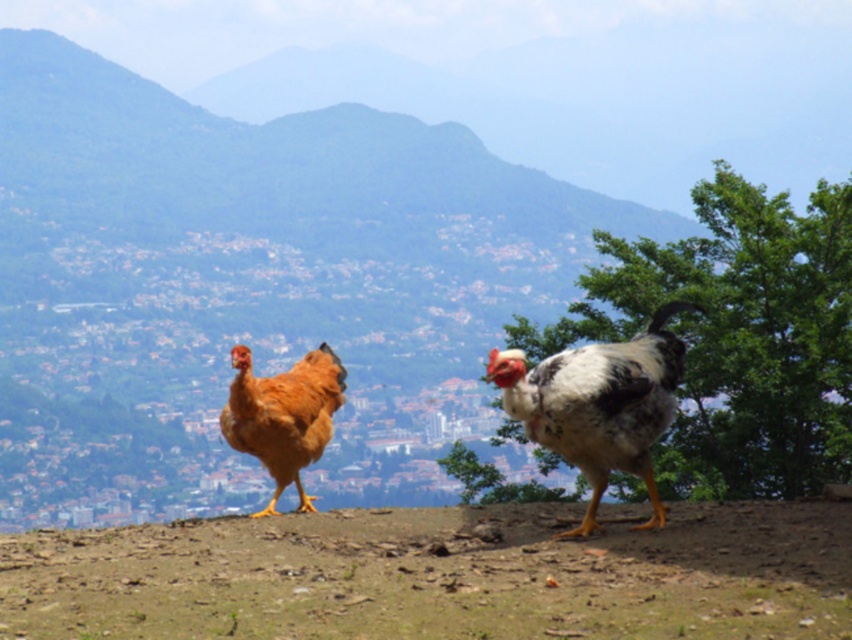
Question: Is white speckled feather at center positioned at the back of golden feathered chicken at center?

Choices:
 (A) yes
 (B) no

Answer: (B)

Question: Does white speckled feather at center appear on the left side of golden feathered chicken at center?

Choices:
 (A) yes
 (B) no

Answer: (B)

Question: Among these points, which one is nearest to the camera?

Choices:
 (A) (602, 403)
 (B) (237, 445)

Answer: (A)

Question: Which point is closer to the camera taking this photo?

Choices:
 (A) (321, 426)
 (B) (609, 417)

Answer: (B)

Question: Is white speckled feather at center positioned before golden feathered chicken at center?

Choices:
 (A) no
 (B) yes

Answer: (B)

Question: Among these points, which one is nearest to the camera?

Choices:
 (A) (281, 432)
 (B) (668, 381)

Answer: (B)